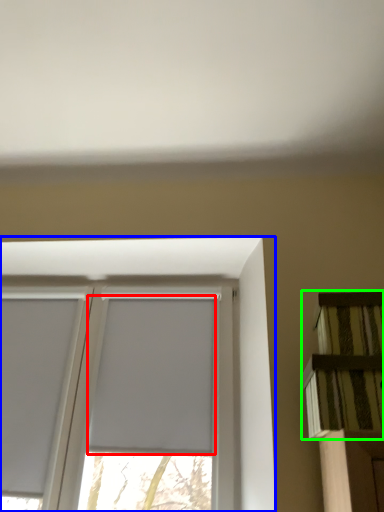
Question: Which is farther away from window screen (highlighted by a red box)? window (highlighted by a blue box) or shelf (highlighted by a green box)?

Choices:
 (A) window
 (B) shelf

Answer: (B)